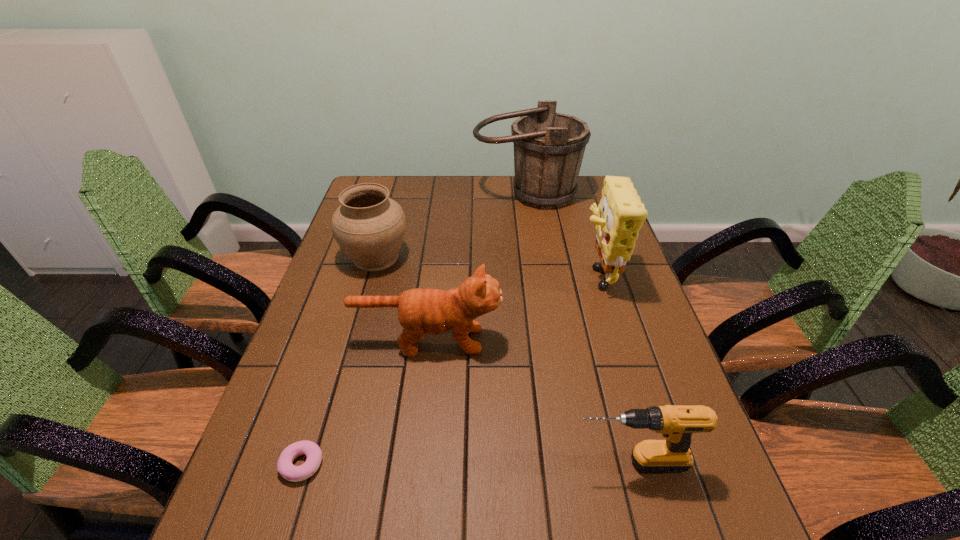
You are a GUI agent. You are given a task and a screenshot of the screen. Output one action in this format:
    pyautogui.click(x=<x>, y=<y>)
    Task: Click on the vacant area that satisfies the following two spatial constraints: 1. on the back side of the pastry; 2. on the left side of the urn
    The height and width of the screenshot is (540, 960).
    Given the screenshot: What is the action you would take?
    pyautogui.click(x=367, y=257)

You are a GUI agent. You are given a task and a screenshot of the screen. Output one action in this format:
    pyautogui.click(x=<x>, y=<y>)
    Task: Click on the free region that satisfies the following two spatial constraints: 1. on the handle side of the farthest object; 2. on the face of the fourth farthest object
    This screenshot has width=960, height=540.
    Given the screenshot: What is the action you would take?
    pyautogui.click(x=548, y=340)